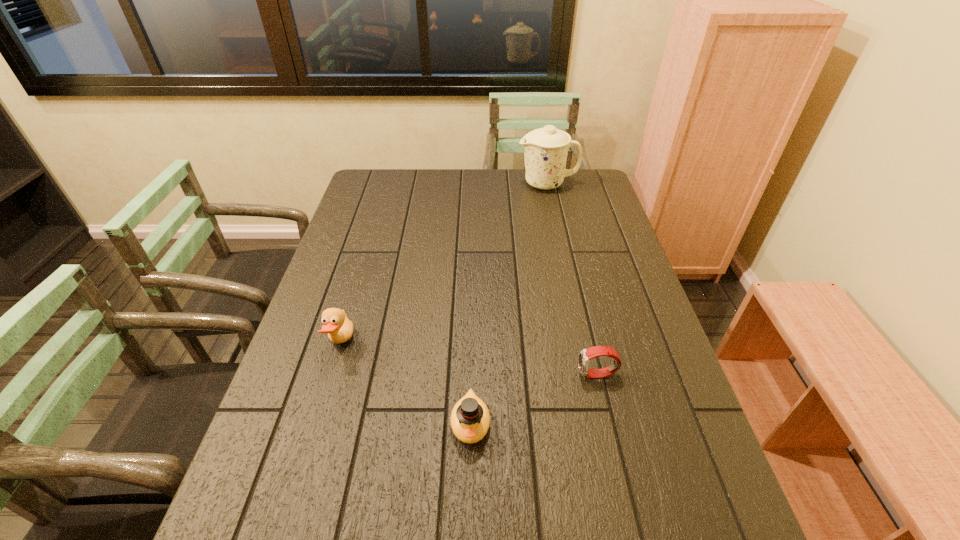
Identify the location of vacant area between the second tallest object and the farthest object. The image size is (960, 540). (444, 264).

This screenshot has height=540, width=960. Find the location of `unoccupied position between the leftmost object and the right duck`. unoccupied position between the leftmost object and the right duck is located at coordinates (406, 383).

At what (x,y) coordinates should I click in order to perform the action: click on free space between the chinaware and the shorter duck. Please return your answer as a coordinate pair (x, y). Looking at the image, I should click on (509, 304).

You are a GUI agent. You are given a task and a screenshot of the screen. Output one action in this format:
    pyautogui.click(x=<x>, y=<y>)
    Task: Click on the vacant area that lies between the nearest object and the watch
    The height and width of the screenshot is (540, 960).
    Given the screenshot: What is the action you would take?
    pyautogui.click(x=534, y=399)

Locate which object is the closest to the third shortest object. Please provide its 2D coordinates. Your answer should be formatted as a tuple, i.e. [(x, y)], where the tuple contains the x and y coordinates of a point satisfying the conditions above.

[(470, 419)]

The width and height of the screenshot is (960, 540). I want to click on object that is the second closest to the farther duck, so click(x=585, y=355).

What are the coordinates of `vacant area in the image that satisfies the following two spatial constraints: 1. on the spout of the chinaware; 2. on the front-facing side of the shorter duck` in the screenshot? It's located at (600, 423).

Find the location of a particular element. This screenshot has height=540, width=960. vacant area in the image that satisfies the following two spatial constraints: 1. on the face of the watch; 2. on the front-facing side of the shorter duck is located at coordinates click(609, 423).

Identify the location of vacant area that satisfies the following two spatial constraints: 1. on the spout of the chinaware; 2. on the front-facing side of the nearer duck. This screenshot has height=540, width=960. (600, 423).

Locate an element on the screen. This screenshot has width=960, height=540. free region that satisfies the following two spatial constraints: 1. on the face of the watch; 2. on the front-facing side of the shorter duck is located at coordinates (609, 423).